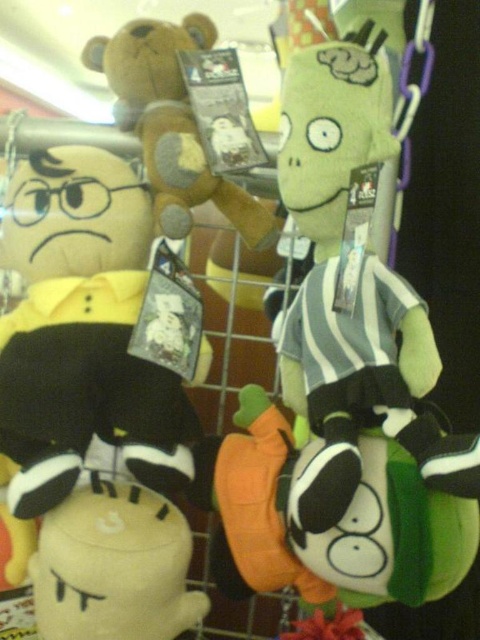
You are a store employee arranging the shelves. You need to place a new rectangular box that is 12 inches wide. The black plush toy at left and the white plush toy at lower left are already on the shelf. Can you fit the box between them without moving the existing toys?

The black plush toy at left might be wider than the white plush toy at lower left, so the space between them may not be wide enough to fit the 12 inch box. Check the actual width before placing the box.

You are a customer looking at the metal shelving unit with the Rugrats plush toys. There is a black plush toy at left and another toy represented by point (87, 333). Which toy is closer to the left side?

The black plush toy at left is closer to the left side because it is explicitly described as being on the left, while the other toy is represented by coordinates which may indicate its position but does not specify left alignment.

You are a customer in a toy store looking at the metal shelving unit. You want to place both the black plush toy at left and the brown plush bear at upper center on a shelf that can only hold items up to 30 cm in height. Knowing their heights, can both fit on the shelf?

The black plush toy at left is taller than the brown plush bear at upper center. If the shelf can only hold items up to 30 cm, both can only fit if the black plush toy at left is under 30 cm. However, since we don